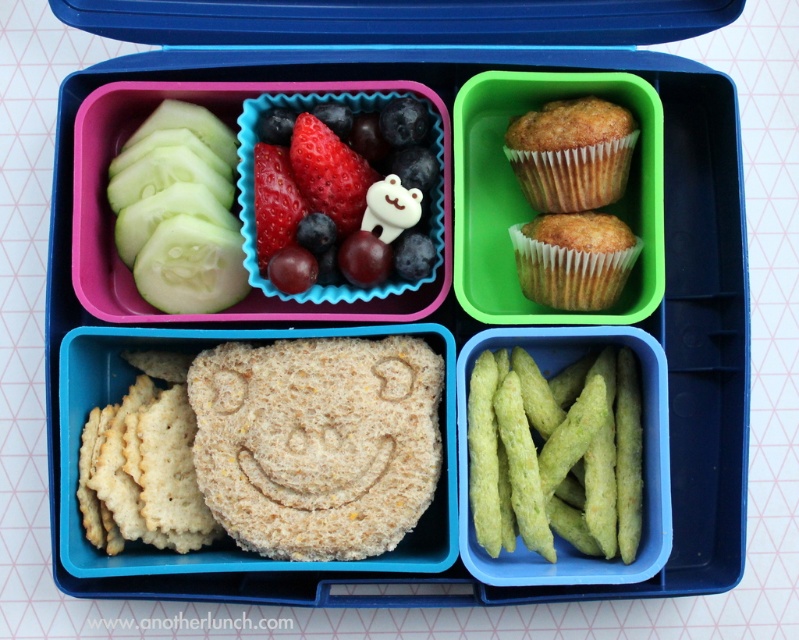
Is the position of green textured vegetable at bottom right less distant than that of golden-brown muffin at upper right?

Yes, green textured vegetable at bottom right is in front of golden-brown muffin at upper right.

Looking at this image, can you confirm if green textured vegetable at bottom right is shorter than golden-brown muffin at upper right?

In fact, green textured vegetable at bottom right may be taller than golden-brown muffin at upper right.

Between point (539, 461) and point (547, 220), which one is positioned behind?

Point (547, 220)

You are a GUI agent. You are given a task and a screenshot of the screen. Output one action in this format:
    pyautogui.click(x=<x>, y=<y>)
    Task: Click on the green textured vegetable at bottom right
    The image size is (799, 640).
    Given the screenshot: What is the action you would take?
    pyautogui.click(x=571, y=454)

Does brown crumbly sandwich at center lie in front of golden-brown muffin at upper right?

Yes, it is in front of golden-brown muffin at upper right.

Does brown crumbly sandwich at center appear on the right side of golden-brown muffin at upper right?

In fact, brown crumbly sandwich at center is to the left of golden-brown muffin at upper right.

Where is `brown crumbly sandwich at center`? The height and width of the screenshot is (640, 799). brown crumbly sandwich at center is located at coordinates (317, 442).

The height and width of the screenshot is (640, 799). What are the coordinates of `brown crumbly sandwich at center` in the screenshot? It's located at (317, 442).

Is green smooth cucumber slices at left shorter than smooth white bear at center?

No.

From the picture: Is green smooth cucumber slices at left in front of smooth white bear at center?

No, green smooth cucumber slices at left is behind smooth white bear at center.

The height and width of the screenshot is (640, 799). What do you see at coordinates (179, 211) in the screenshot?
I see `green smooth cucumber slices at left` at bounding box center [179, 211].

Find the location of a particular element. This screenshot has width=799, height=640. green smooth cucumber slices at left is located at coordinates (179, 211).